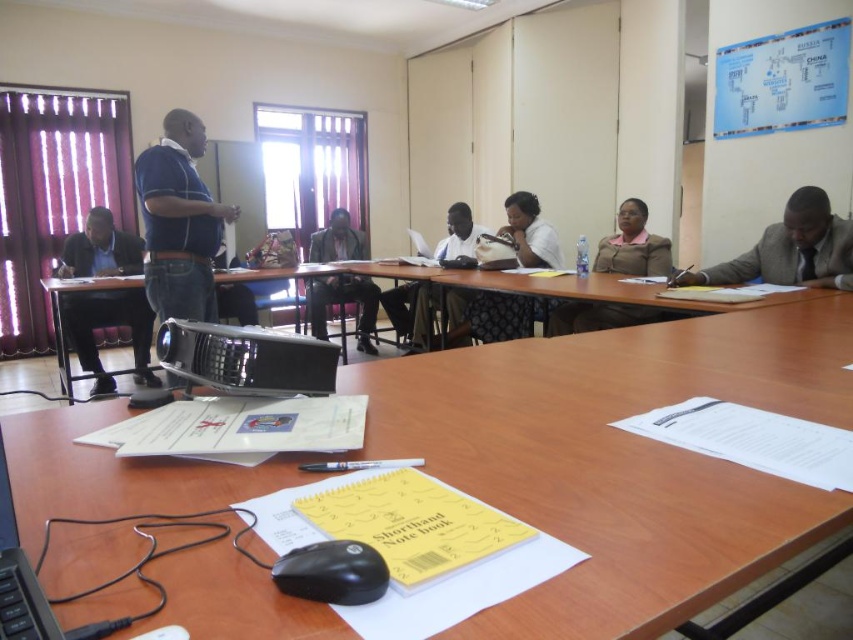
Question: Does matte brown jacket at center have a smaller size compared to black plastic mouse at lower center?

Choices:
 (A) no
 (B) yes

Answer: (A)

Question: Does wooden table at center lie in front of black plastic projector at lower left?

Choices:
 (A) no
 (B) yes

Answer: (B)

Question: Which point is closer to the camera taking this photo?

Choices:
 (A) (843, 282)
 (B) (465, 214)

Answer: (A)

Question: Which object is closer to the camera taking this photo?

Choices:
 (A) dark gray suit at right
 (B) black plastic projector at lower left
 (C) silver metallic projector at lower left
 (D) dark brown leather jacket at center

Answer: (C)

Question: Based on their relative distances, which object is farther from the matte black bag at center?

Choices:
 (A) matte black suit at left
 (B) brown wooden table at center
 (C) wooden table at center
 (D) matte brown jacket at center

Answer: (C)

Question: Does dark gray suit at right lie in front of matte brown jacket at center?

Choices:
 (A) no
 (B) yes

Answer: (B)